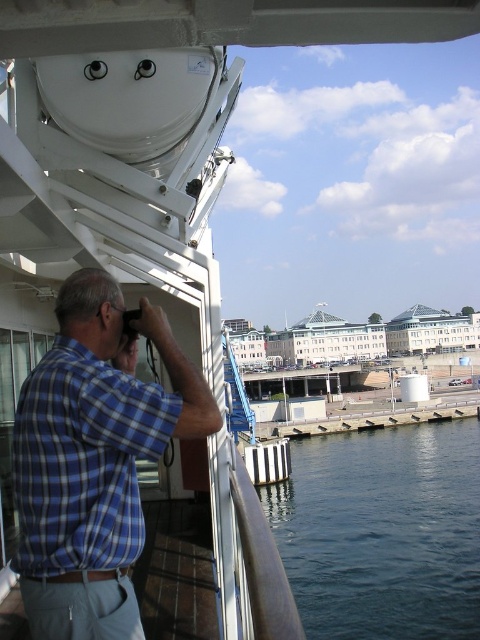
Question: Does blue plaid shirt at left appear on the right side of dark blue water at lower right?

Choices:
 (A) yes
 (B) no

Answer: (B)

Question: Is blue plaid shirt at left in front of dark blue water at lower right?

Choices:
 (A) no
 (B) yes

Answer: (B)

Question: Does blue plaid shirt at left appear on the left side of dark blue water at lower right?

Choices:
 (A) yes
 (B) no

Answer: (A)

Question: Among these points, which one is nearest to the camera?

Choices:
 (A) (177, 380)
 (B) (304, 456)

Answer: (A)

Question: Which of the following is the farthest from the observer?

Choices:
 (A) (414, 557)
 (B) (199, 428)

Answer: (A)